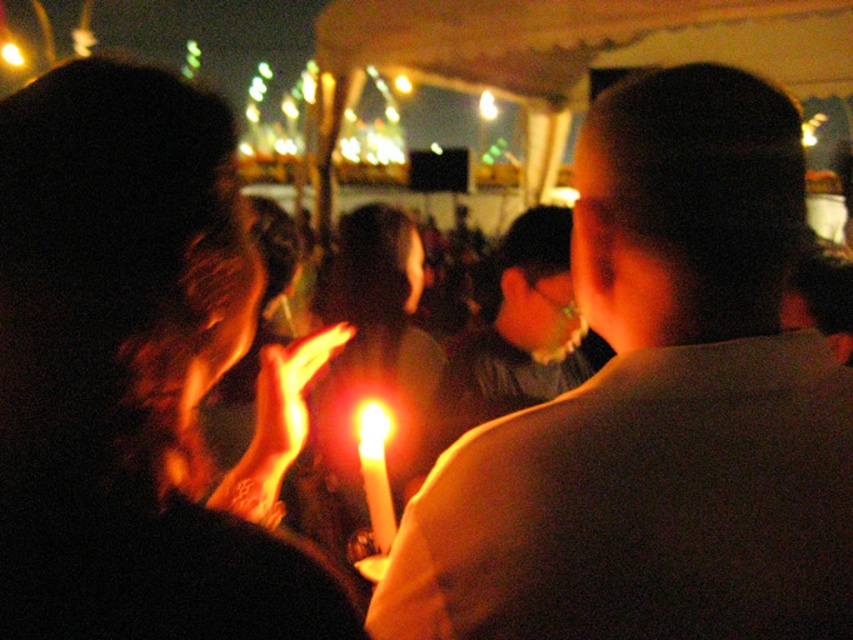
You are at a candlelit vigil and need to place a new candle between the matte white candle at center and the matte black candle at center. The new candle must be exactly 10 inches away from both. Is this possible?

The distance between the matte white candle at center and the matte black candle at center is 9.50 inches. Since the new candle needs to be 10 inches away from both, it would require a total distance of 20 inches between them, which is longer than the current 9.50 inches. Therefore, it is not possible to place the new candle as required.